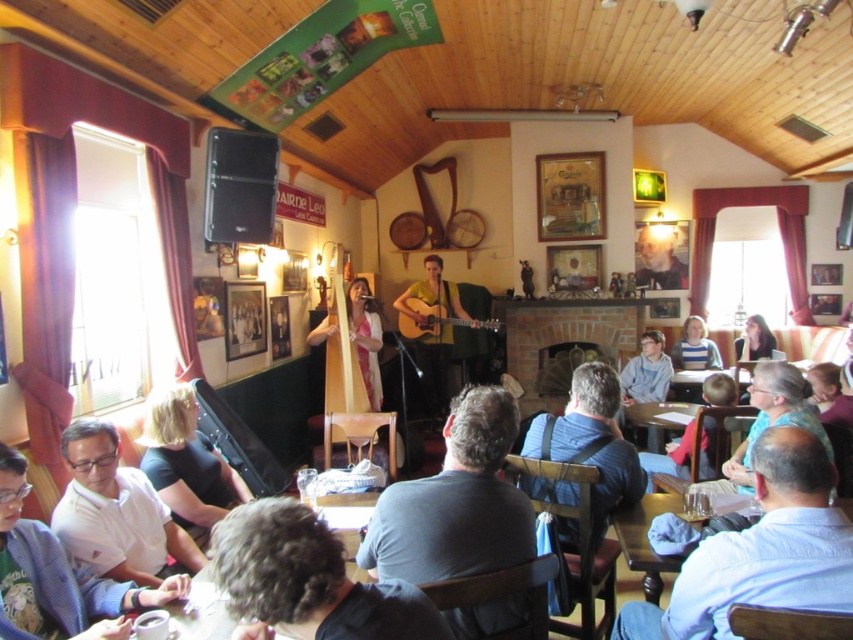
From the picture: Can you confirm if white shirt at lower left is positioned to the left of green matte guitar at center?

Indeed, white shirt at lower left is positioned on the left side of green matte guitar at center.

This screenshot has height=640, width=853. What do you see at coordinates (57, 577) in the screenshot?
I see `white shirt at lower left` at bounding box center [57, 577].

Where is `white shirt at lower left`? Image resolution: width=853 pixels, height=640 pixels. white shirt at lower left is located at coordinates (57, 577).

Which is more to the right, white shirt at lower left or matte black microphone at center?

matte black microphone at center

Can you confirm if white shirt at lower left is shorter than matte black microphone at center?

Incorrect, white shirt at lower left's height does not fall short of matte black microphone at center's.

Which is behind, point (19, 452) or point (738, 346)?

The point (738, 346) is more distant.

At what (x,y) coordinates should I click in order to perform the action: click on white shirt at lower left. Please return your answer as a coordinate pair (x, y). Looking at the image, I should click on (57, 577).

Is dark brown hair at lower center to the right of blue fabric bag at center from the viewer's perspective?

No, dark brown hair at lower center is not to the right of blue fabric bag at center.

Can you confirm if dark brown hair at lower center is positioned above blue fabric bag at center?

Indeed, dark brown hair at lower center is positioned over blue fabric bag at center.

Locate an element on the screen. The image size is (853, 640). dark brown hair at lower center is located at coordinates click(x=306, y=580).